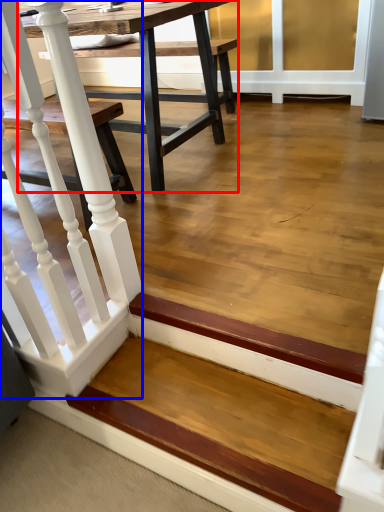
Question: Among these objects, which one is farthest to the camera, table (highlighted by a red box) or rail (highlighted by a blue box)?

Choices:
 (A) table
 (B) rail

Answer: (A)